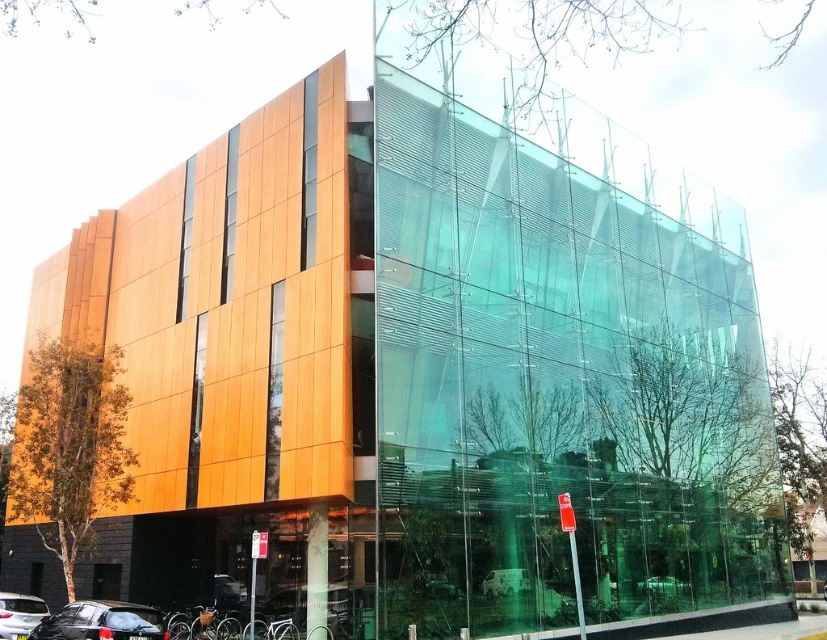
Does black matte car at lower left have a larger size compared to shiny black car at lower left?

Indeed, black matte car at lower left has a larger size compared to shiny black car at lower left.

Does point (70, 604) come in front of point (29, 621)?

Yes, it is.

Locate an element on the screen. The width and height of the screenshot is (827, 640). black matte car at lower left is located at coordinates (101, 621).

Does shiny black car at lower left appear over metallic silver car at center?

Yes, shiny black car at lower left is above metallic silver car at center.

Which is behind, point (22, 632) or point (646, 592)?

Positioned behind is point (646, 592).

Identify the location of shiny black car at lower left. (18, 614).

Which is above, black matte car at lower left or metallic silver car at center?

black matte car at lower left is higher up.

Which is more to the left, black matte car at lower left or metallic silver car at center?

black matte car at lower left

Find the location of a particular element. black matte car at lower left is located at coordinates (101, 621).